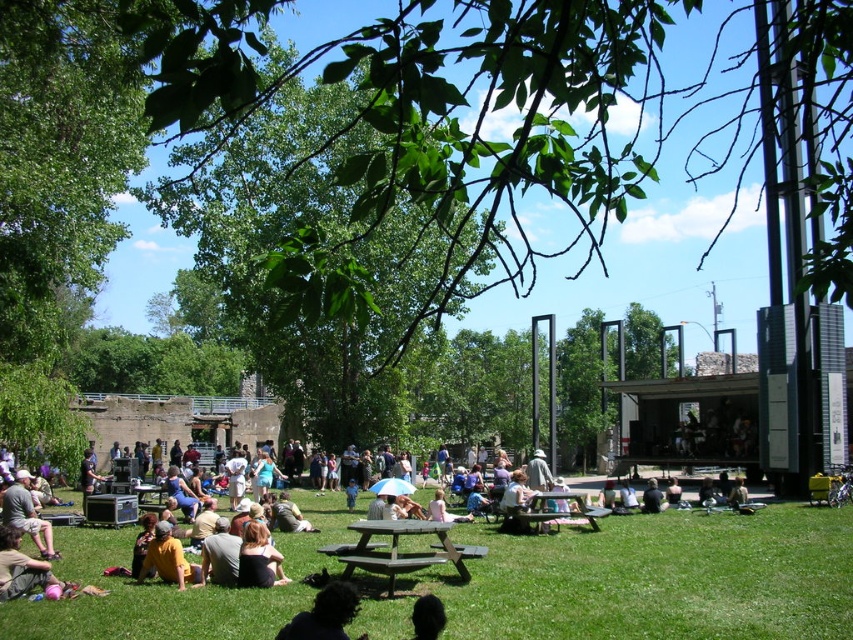
Question: Which object is closer to the camera taking this photo?

Choices:
 (A) black hair at lower center
 (B) green leafy tree at upper center
 (C) wooden picnic table at center

Answer: (B)

Question: Can you confirm if green leafy tree at upper center is bigger than wooden picnic table at center?

Choices:
 (A) no
 (B) yes

Answer: (B)

Question: Can you confirm if green grassy field at lower center is thinner than dark brown hair at lower center?

Choices:
 (A) yes
 (B) no

Answer: (B)

Question: Which object is the farthest from the green leafy tree at upper center?

Choices:
 (A) matte yellow shirt at lower left
 (B) wooden picnic table at center

Answer: (A)

Question: Which point appears closest to the camera in this image?

Choices:
 (A) coord(357,278)
 (B) coord(9,572)
 (C) coord(437,636)

Answer: (A)

Question: Does green grassy field at lower center have a smaller size compared to wooden picnic table at center?

Choices:
 (A) yes
 (B) no

Answer: (B)